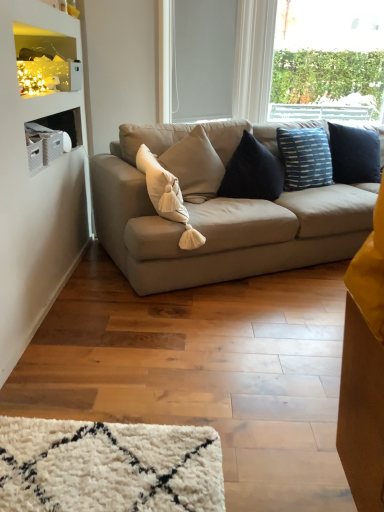
Locate an element on the screen. The width and height of the screenshot is (384, 512). space that is in front of suede beige couch at center is located at coordinates [192, 362].